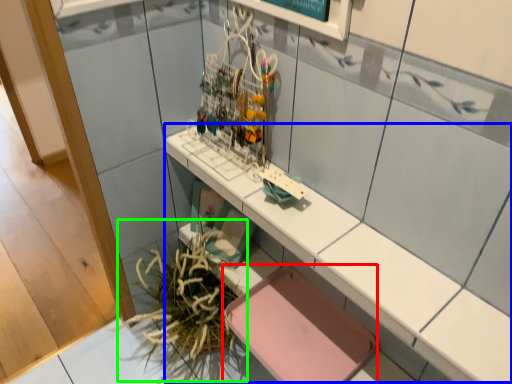
Question: Which is nearer to the chair (highlighted by a red box)? counter (highlighted by a blue box) or plant (highlighted by a green box).

Choices:
 (A) counter
 (B) plant

Answer: (B)